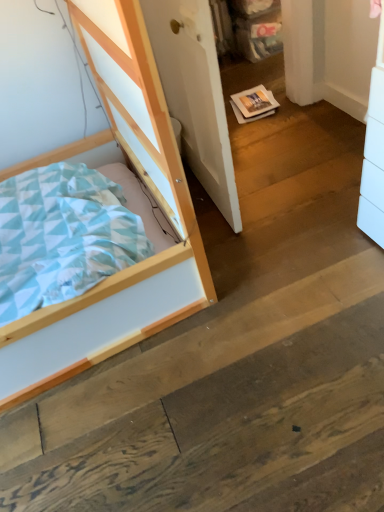
The width and height of the screenshot is (384, 512). I want to click on unoccupied area in front of white matte door at center, so click(x=268, y=251).